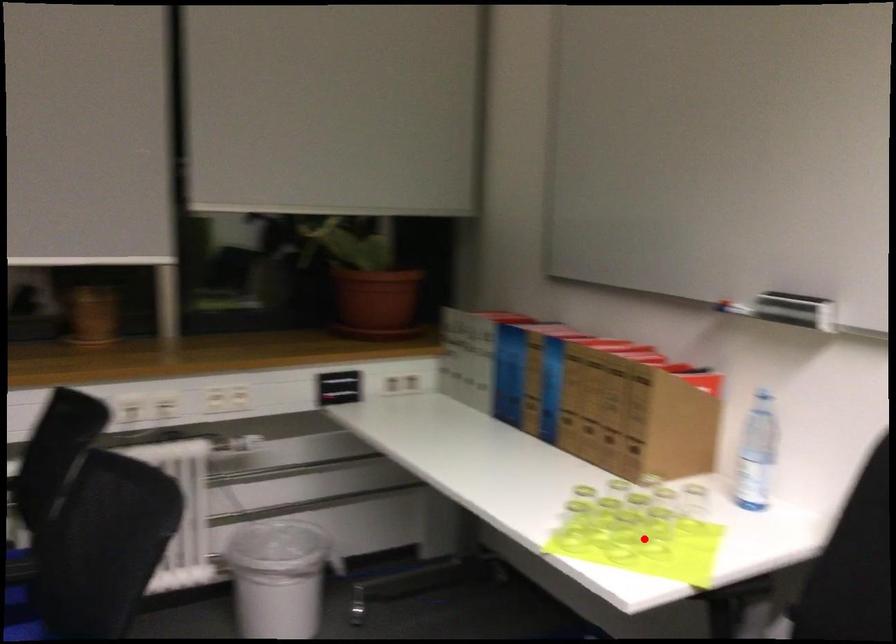
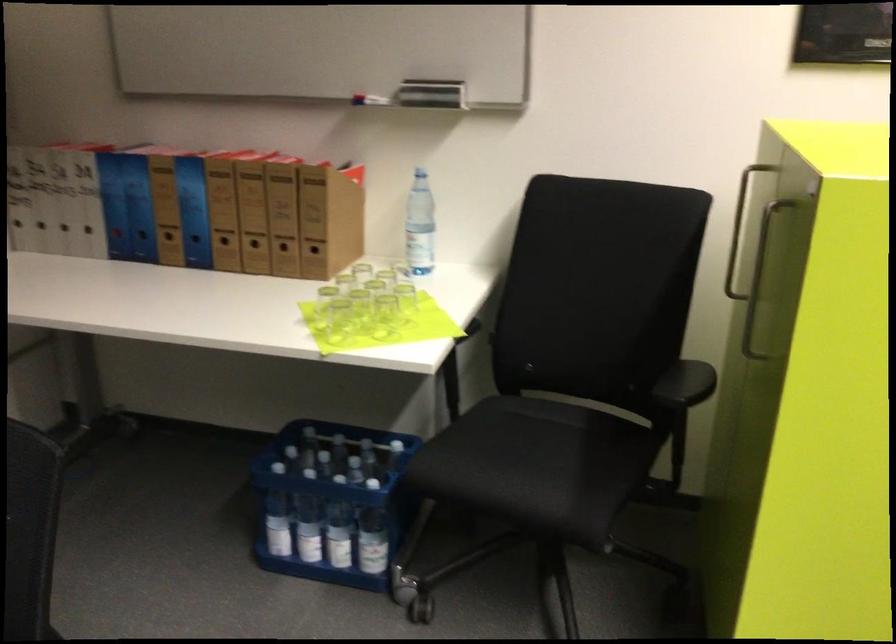
Question: A red point is marked in image1. In image2, is the corresponding 3D point closer to the camera or farther? Reply with the corresponding letter.

Choices:
 (A) The corresponding 3D point is closer.
 (B) The corresponding 3D point is farther.

Answer: (B)